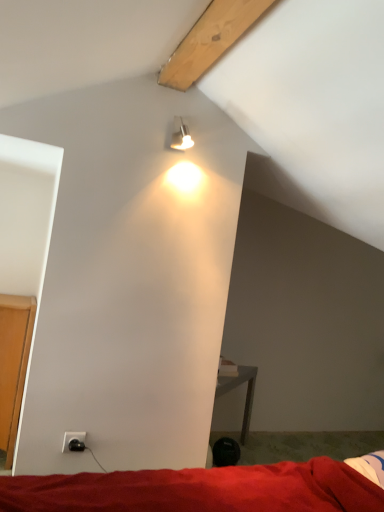
Question: From the image's perspective, is red fabric bed at lower center located above or below black plastic power outlet at lower left?

Choices:
 (A) below
 (B) above

Answer: (A)

Question: Looking at the image, does red fabric bed at lower center seem bigger or smaller compared to black plastic power outlet at lower left?

Choices:
 (A) small
 (B) big

Answer: (B)

Question: Which of these objects is positioned closest to the metallic silver spotlight at upper center?

Choices:
 (A) black plastic power outlet at lower left
 (B) red fabric bed at lower center

Answer: (A)

Question: Considering the real-world distances, which object is farthest from the metallic silver spotlight at upper center?

Choices:
 (A) red fabric bed at lower center
 (B) black plastic power outlet at lower left

Answer: (A)